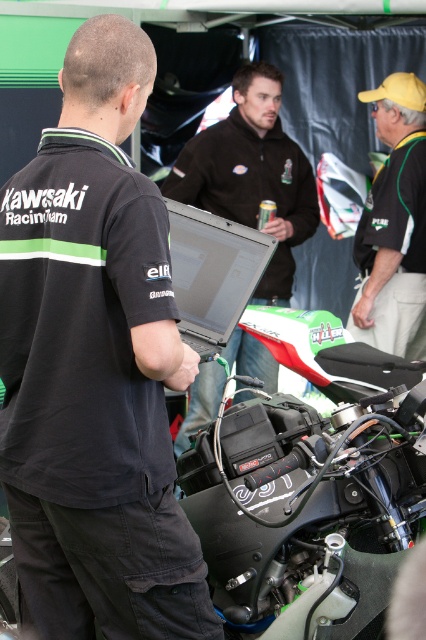
You are standing in the motorcycle pit area and want to take a photo of the two points marked in the scene. Which point, point 1 at coordinates (293, 433) or point 2 at coordinates (417, 285), will appear larger in your photo?

Point 1 at coordinates (293, 433) will appear larger in the photo because it is closer to the camera than point 2 at coordinates (417, 285).

You are a photographer at the motorcycle event and want to take a photo that includes both the black fabric shirt at center and the dark brown leather jacket at center. Which object should you focus on first to ensure both are in the frame?

The black fabric shirt at center is much taller than the dark brown leather jacket at center, so you should focus on the black fabric shirt at center first to ensure both are in the frame.